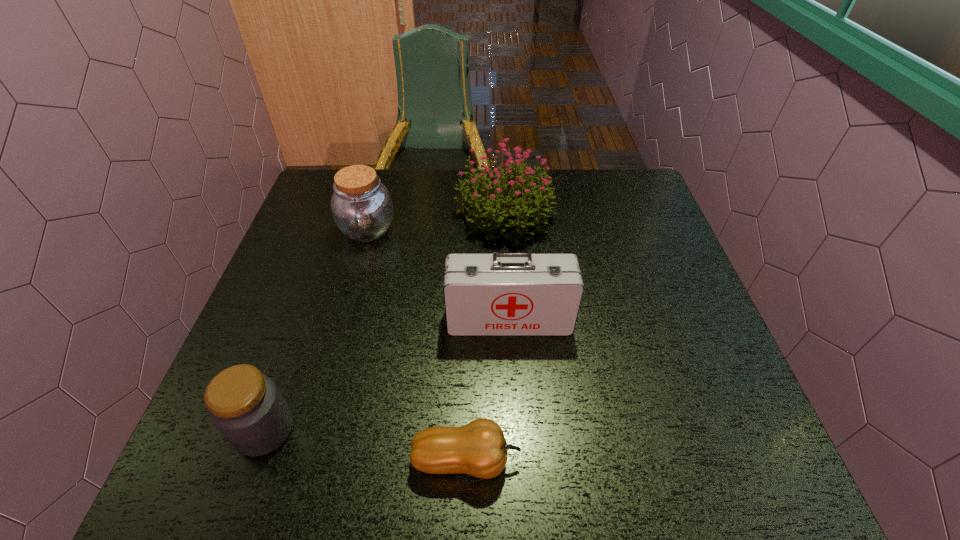
Identify the location of bouquet positioned at the far edge. (487, 205).

Identify the location of jar located in the far edge section of the desktop. The image size is (960, 540). (362, 208).

You are a GUI agent. You are given a task and a screenshot of the screen. Output one action in this format:
    pyautogui.click(x=<x>, y=<y>)
    Task: Click on the jar at the near edge
    This screenshot has height=540, width=960.
    Given the screenshot: What is the action you would take?
    pyautogui.click(x=245, y=405)

Identify the location of gourd at the near edge. The width and height of the screenshot is (960, 540). (479, 449).

I want to click on object present at the far left corner, so click(362, 208).

Locate an element on the screen. The width and height of the screenshot is (960, 540). object at the near left corner is located at coordinates (245, 405).

Find the location of a particular element. Image resolution: width=960 pixels, height=540 pixels. free location at the far edge of the desktop is located at coordinates (418, 212).

Image resolution: width=960 pixels, height=540 pixels. Find the location of `vacant area at the right edge of the desktop`. vacant area at the right edge of the desktop is located at coordinates (620, 249).

The width and height of the screenshot is (960, 540). I want to click on vacant space at the near left corner, so click(x=209, y=476).

Image resolution: width=960 pixels, height=540 pixels. I want to click on free space at the far right corner of the desktop, so click(616, 181).